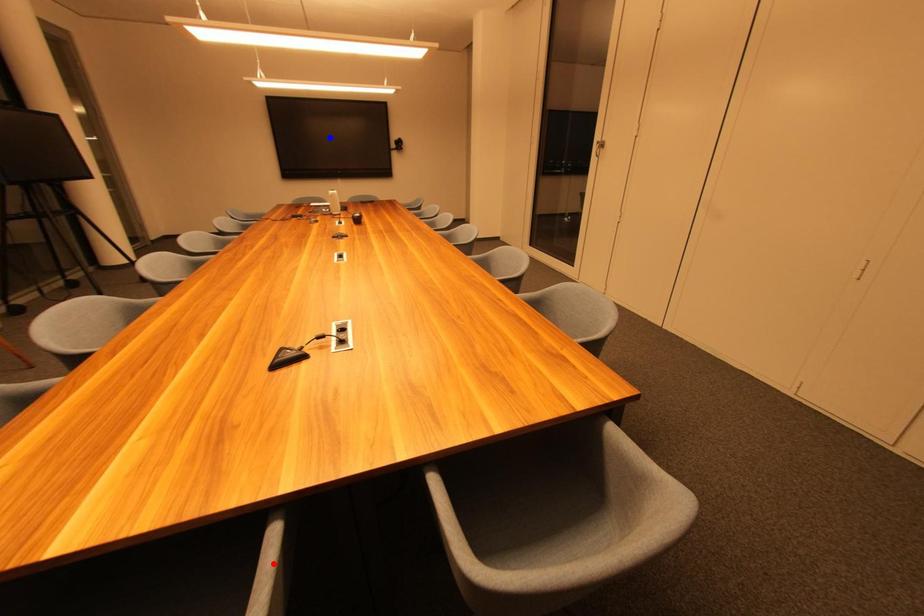
Question: Which of the two points in the image is closer to the camera?

Choices:
 (A) Blue point is closer.
 (B) Red point is closer.

Answer: (B)